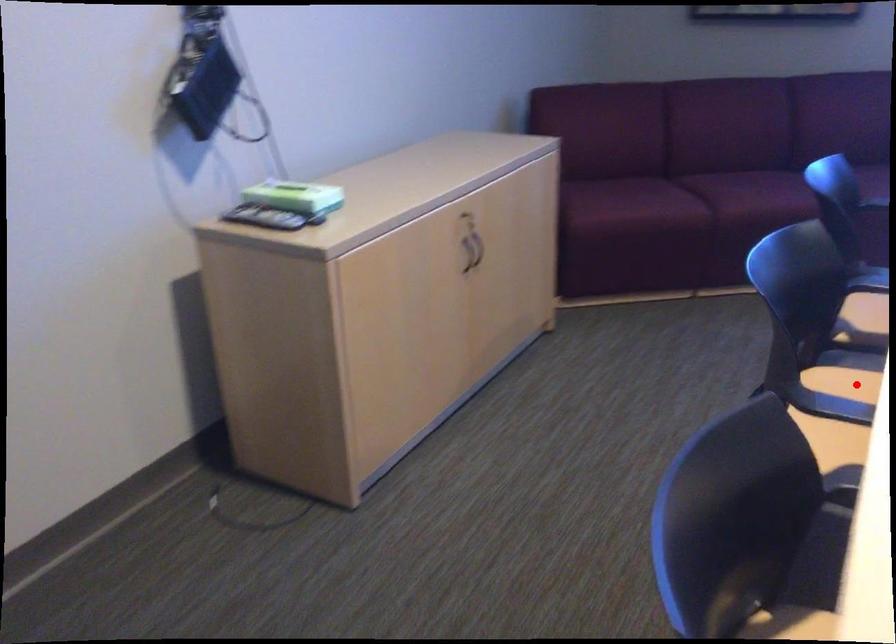
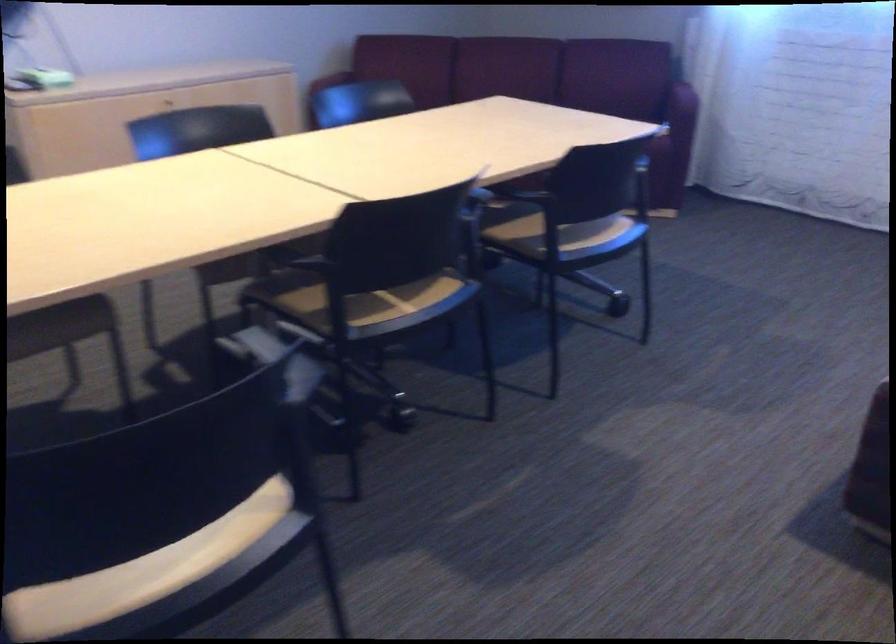
Question: I am providing you with two images of the same scene from different viewpoints. A red point is marked on the first image. Is the red point's position out of view in image 2?

Choices:
 (A) Yes
 (B) No

Answer: (A)